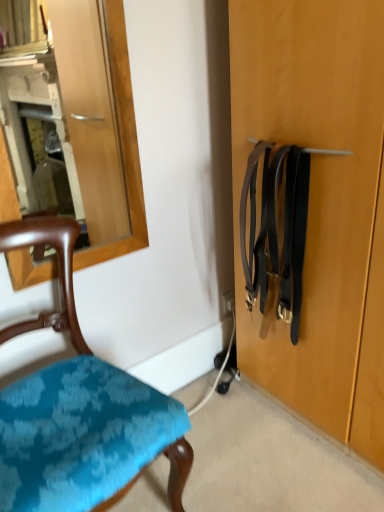
This screenshot has height=512, width=384. Describe the element at coordinates (276, 229) in the screenshot. I see `black leather suspenders at right` at that location.

At what (x,y) coordinates should I click in order to perform the action: click on black leather suspenders at right. Please return your answer as a coordinate pair (x, y). The image size is (384, 512). Looking at the image, I should click on (276, 229).

Locate an element on the screen. Image resolution: width=384 pixels, height=512 pixels. teal fabric chair at lower left is located at coordinates (60, 272).

Describe the element at coordinates (60, 272) in the screenshot. I see `teal fabric chair at lower left` at that location.

Identify the location of black leather suspenders at right. This screenshot has height=512, width=384. (276, 229).

Between black leather suspenders at right and teal fabric chair at lower left, which one appears on the left side from the viewer's perspective?

teal fabric chair at lower left.

Considering the relative positions of black leather suspenders at right and teal fabric chair at lower left in the image provided, is black leather suspenders at right behind teal fabric chair at lower left?

Yes.

Which is further, [284,227] or [79,335]?

The point [284,227] is farther from the camera.

From the image's perspective, which is below, black leather suspenders at right or teal fabric chair at lower left?

teal fabric chair at lower left, from the image's perspective.

From the picture: From a real-world perspective, who is located higher, black leather suspenders at right or teal fabric chair at lower left?

In real-world perspective, black leather suspenders at right is above.

Considering the relative sizes of black leather suspenders at right and teal fabric chair at lower left in the image provided, is black leather suspenders at right thinner than teal fabric chair at lower left?

Correct, the width of black leather suspenders at right is less than that of teal fabric chair at lower left.

In terms of height, does black leather suspenders at right look taller or shorter compared to teal fabric chair at lower left?

In the image, black leather suspenders at right appears to be shorter than teal fabric chair at lower left.

In terms of size, does black leather suspenders at right appear bigger or smaller than teal fabric chair at lower left?

Considering their sizes, black leather suspenders at right takes up less space than teal fabric chair at lower left.

Is black leather suspenders at right not inside teal fabric chair at lower left?

black leather suspenders at right lies outside teal fabric chair at lower left's area.

Does black leather suspenders at right touch teal fabric chair at lower left?

black leather suspenders at right is not next to teal fabric chair at lower left, and they're not touching.

Is black leather suspenders at right facing towards teal fabric chair at lower left?

Yes, black leather suspenders at right is facing teal fabric chair at lower left.

This screenshot has width=384, height=512. In order to click on suspenders located on the right of teal fabric chair at lower left in this screenshot , I will do `click(276, 229)`.

Based on the photo, is teal fabric chair at lower left at the right side of black leather suspenders at right?

No.

Is the depth of teal fabric chair at lower left less than that of black leather suspenders at right?

That is True.

Considering the points (70, 308) and (305, 211), which point is in front, point (70, 308) or point (305, 211)?

Point (70, 308)

From the image's perspective, is teal fabric chair at lower left beneath black leather suspenders at right?

Correct, teal fabric chair at lower left appears lower than black leather suspenders at right in the image.

From a real-world perspective, between teal fabric chair at lower left and black leather suspenders at right, who is vertically lower?

teal fabric chair at lower left is physically lower.

Consider the image. Considering the sizes of teal fabric chair at lower left and black leather suspenders at right in the image, is teal fabric chair at lower left wider or thinner than black leather suspenders at right?

Clearly, teal fabric chair at lower left has more width compared to black leather suspenders at right.

Who is shorter, teal fabric chair at lower left or black leather suspenders at right?

Standing shorter between the two is black leather suspenders at right.

In terms of size, does teal fabric chair at lower left appear bigger or smaller than black leather suspenders at right?

Considering their sizes, teal fabric chair at lower left takes up more space than black leather suspenders at right.

Would you say black leather suspenders at right is part of teal fabric chair at lower left's contents?

No, black leather suspenders at right is located outside of teal fabric chair at lower left.

Is teal fabric chair at lower left far from black leather suspenders at right?

They are positioned close to each other.

Is teal fabric chair at lower left looking in the opposite direction of black leather suspenders at right?

That's not correct — teal fabric chair at lower left is not looking away from black leather suspenders at right.

How many degrees apart are the facing directions of teal fabric chair at lower left and black leather suspenders at right?

The angle between the facing direction of teal fabric chair at lower left and the facing direction of black leather suspenders at right is 89.2 degrees.

Image resolution: width=384 pixels, height=512 pixels. Identify the location of chair in front of the black leather suspenders at right. (60, 272).

This screenshot has height=512, width=384. I want to click on suspenders lying above the teal fabric chair at lower left (from the image's perspective), so click(x=276, y=229).

Where is `suspenders behind the teal fabric chair at lower left`? This screenshot has width=384, height=512. suspenders behind the teal fabric chair at lower left is located at coordinates (276, 229).